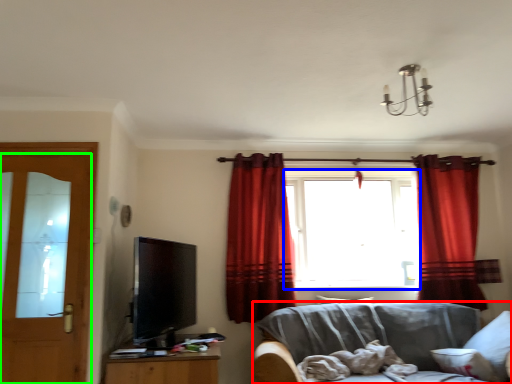
Question: Which is farther away from studio couch (highlighted by a red box)? window (highlighted by a blue box) or door (highlighted by a green box)?

Choices:
 (A) window
 (B) door

Answer: (B)